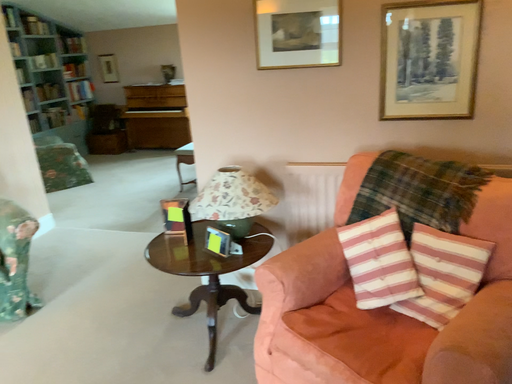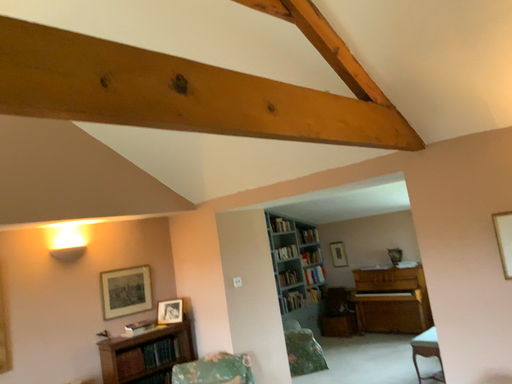
Question: How did the camera likely rotate when shooting the video?

Choices:
 (A) rotated downward
 (B) rotated upward

Answer: (B)